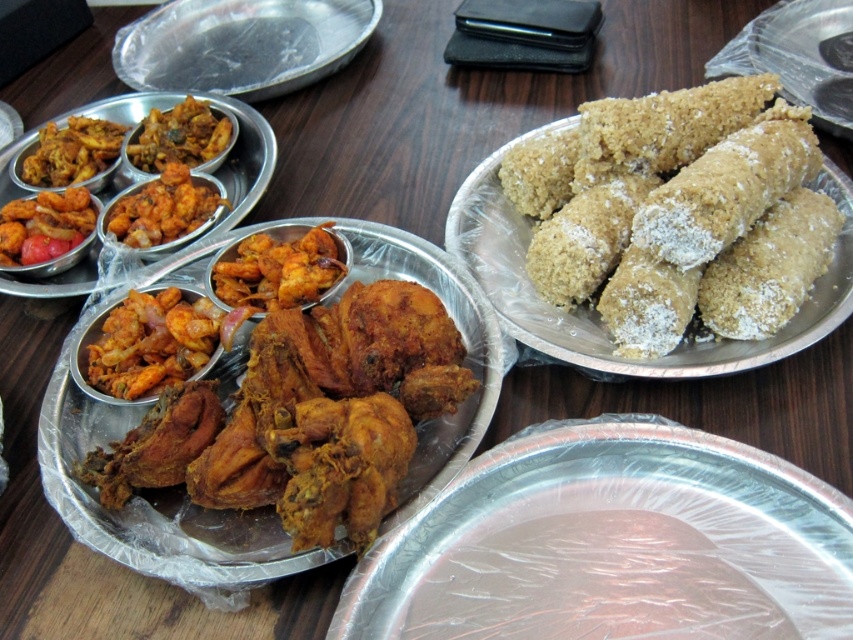
You are sitting at the wooden table and want to reach for the food items. Which of the two points, point (184, 13) or point (200, 321), is closer to you?

Point (200, 321) is closer to you because point (184, 13) is behind it.